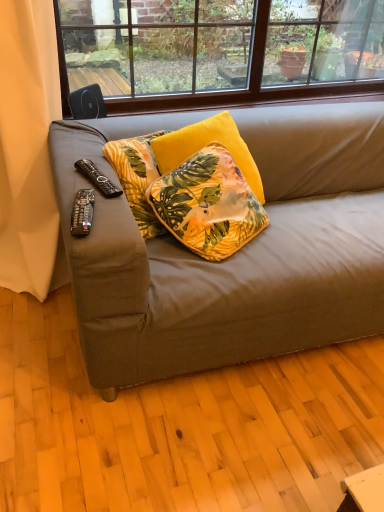
You are a GUI agent. You are given a task and a screenshot of the screen. Output one action in this format:
    pyautogui.click(x=<x>, y=<y>)
    Task: Click on the unoccupied area behind black plastic remote control at lower left, the second remote control viewed from the back
    The width and height of the screenshot is (384, 512).
    Given the screenshot: What is the action you would take?
    pyautogui.click(x=94, y=190)